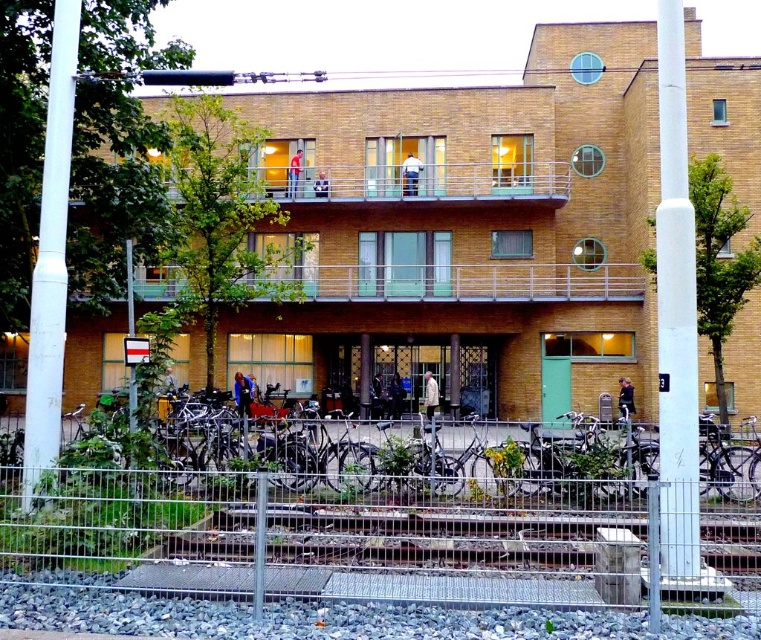
Between white smooth pole at left and brown wooden balcony at upper center, which one appears on the left side from the viewer's perspective?

From the viewer's perspective, white smooth pole at left appears more on the left side.

Looking at this image, who is shorter, white smooth pole at left or brown wooden balcony at upper center?

brown wooden balcony at upper center

Is point (69, 112) positioned behind point (330, 179)?

No.

Find the location of a particular element. The image size is (761, 640). white smooth pole at left is located at coordinates (49, 259).

Consider the image. Can you confirm if white smooth pole at right is positioned below white smooth pole at left?

No, white smooth pole at right is not below white smooth pole at left.

Between white smooth pole at right and white smooth pole at left, which one is positioned higher?

Positioned higher is white smooth pole at right.

This screenshot has height=640, width=761. I want to click on white smooth pole at right, so click(677, 321).

Between white smooth pole at right and brown wooden balcony at upper center, which one appears on the left side from the viewer's perspective?

Positioned to the left is brown wooden balcony at upper center.

Can you confirm if white smooth pole at right is taller than brown wooden balcony at upper center?

No, white smooth pole at right is not taller than brown wooden balcony at upper center.

Is point (686, 397) positioned before point (377, 182)?

Yes.

Where is `white smooth pole at right`? white smooth pole at right is located at coordinates (677, 321).